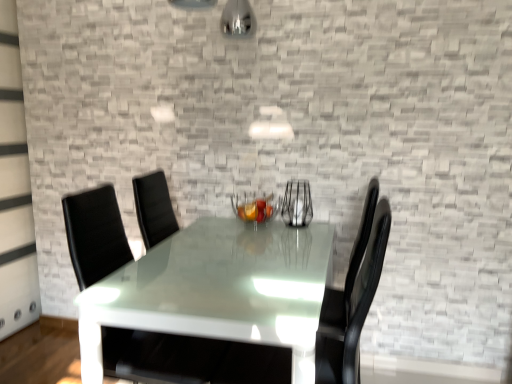
Locate an element on the screen. metallic wire basket at center is located at coordinates (254, 209).

The height and width of the screenshot is (384, 512). What do you see at coordinates (297, 204) in the screenshot? I see `clear glass vase at center` at bounding box center [297, 204].

The image size is (512, 384). What do you see at coordinates (218, 291) in the screenshot?
I see `glossy white table at center` at bounding box center [218, 291].

The height and width of the screenshot is (384, 512). Identify the location of black leather swivel chair at center. (159, 357).

Image resolution: width=512 pixels, height=384 pixels. What are the coordinates of `metallic wire basket at center` in the screenshot? It's located at (254, 209).

Is the position of clear glass vase at center less distant than that of black leather swivel chair at center?

No, it is not.

Between clear glass vase at center and black leather swivel chair at center, which one has larger width?

With larger width is black leather swivel chair at center.

Is clear glass vase at center placed right next to black leather swivel chair at center?

No, clear glass vase at center is not beside black leather swivel chair at center.

Does point (247, 213) lie in front of point (297, 213)?

Yes, it is in front of point (297, 213).

Looking at this image, would you say clear glass vase at center is part of metallic wire basket at center's contents?

Definitely not — clear glass vase at center is not inside metallic wire basket at center.

Is metallic wire basket at center next to clear glass vase at center?

metallic wire basket at center is not next to clear glass vase at center, and they're not touching.

Which of these two, glossy white table at center or metallic wire basket at center, is thinner?

Thinner between the two is metallic wire basket at center.

From a real-world perspective, is glossy white table at center on top of metallic wire basket at center?

Actually, glossy white table at center is physically below metallic wire basket at center in the real world.

What's the angular difference between glossy white table at center and metallic wire basket at center's facing directions?

glossy white table at center and metallic wire basket at center are facing 0.195 degrees away from each other.

In the scene shown: Which of these two, glossy white table at center or black leather swivel chair at center, is wider?

glossy white table at center is wider.

From the picture: From the image's perspective, is glossy white table at center over black leather swivel chair at center?

No, from the image's perspective, glossy white table at center is not above black leather swivel chair at center.

Considering the relative sizes of glossy white table at center and black leather swivel chair at center in the image provided, is glossy white table at center smaller than black leather swivel chair at center?

Actually, glossy white table at center might be larger than black leather swivel chair at center.

Does glossy white table at center turn towards black leather swivel chair at center?

Yes, glossy white table at center faces towards black leather swivel chair at center.

Is clear glass vase at center positioned behind metallic wire basket at center?

Yes, it is behind metallic wire basket at center.

Based on their positions, is clear glass vase at center located to the left or right of metallic wire basket at center?

Based on their positions, clear glass vase at center is located to the right of metallic wire basket at center.

Locate an element on the screen. glass vase above the metallic wire basket at center (from the image's perspective) is located at coordinates (297, 204).

Is clear glass vase at center not near metallic wire basket at center?

They are positioned close to each other.

I want to click on table in front of the clear glass vase at center, so click(218, 291).

Is glossy white table at center positioned behind clear glass vase at center?

No.

Does glossy white table at center turn towards clear glass vase at center?

No, glossy white table at center is not facing towards clear glass vase at center.

Does metallic wire basket at center lie in front of black leather swivel chair at center?

No, metallic wire basket at center is further to the viewer.

Is black leather swivel chair at center at the back of metallic wire basket at center?

No, metallic wire basket at center is not facing away from black leather swivel chair at center.

Is metallic wire basket at center bigger or smaller than black leather swivel chair at center?

metallic wire basket at center is smaller than black leather swivel chair at center.

Is metallic wire basket at center taller or shorter than black leather swivel chair at center?

Clearly, metallic wire basket at center is shorter compared to black leather swivel chair at center.

At what (x,y) coordinates should I click in order to perform the action: click on glass vase located on the right of black leather swivel chair at center. Please return your answer as a coordinate pair (x, y). This screenshot has height=384, width=512. Looking at the image, I should click on (297, 204).

Find the location of `glass vase positioned vertically above the metallic wire basket at center (from a real-world perspective)`. glass vase positioned vertically above the metallic wire basket at center (from a real-world perspective) is located at coordinates (297, 204).

When comparing their distances from clear glass vase at center, does glossy white table at center or metallic wire basket at center seem further?

glossy white table at center.

Which object lies nearer to the anchor point clear glass vase at center, black leather swivel chair at center or glossy white table at center?

The object closer to clear glass vase at center is glossy white table at center.

Based on their spatial positions, is metallic wire basket at center or glossy white table at center further from clear glass vase at center?

glossy white table at center.

Based on their spatial positions, is black leather swivel chair at center or metallic wire basket at center further from clear glass vase at center?

black leather swivel chair at center.

Estimate the real-world distances between objects in this image. Which object is further from glossy white table at center, clear glass vase at center or black leather swivel chair at center?

clear glass vase at center.

Considering their positions, is glossy white table at center positioned closer to clear glass vase at center than black leather swivel chair at center?

glossy white table at center.

Based on their spatial positions, is black leather swivel chair at center or clear glass vase at center further from metallic wire basket at center?

black leather swivel chair at center is positioned further to the anchor metallic wire basket at center.

When comparing their distances from black leather swivel chair at center, does metallic wire basket at center or glossy white table at center seem closer?

Among the two, glossy white table at center is located nearer to black leather swivel chair at center.

The width and height of the screenshot is (512, 384). What are the coordinates of `swivel chair positioned between glossy white table at center and metallic wire basket at center from near to far` in the screenshot? It's located at (159, 357).

This screenshot has height=384, width=512. Identify the location of swivel chair between glossy white table at center and clear glass vase at center in the front-back direction. (159, 357).

You are a GUI agent. You are given a task and a screenshot of the screen. Output one action in this format:
    pyautogui.click(x=<x>, y=<y>)
    Task: Click on the candle holder between glossy white table at center and clear glass vase at center from front to back
    Image resolution: width=512 pixels, height=384 pixels.
    Given the screenshot: What is the action you would take?
    pyautogui.click(x=254, y=209)

Image resolution: width=512 pixels, height=384 pixels. I want to click on candle holder between black leather swivel chair at center and clear glass vase at center in the front-back direction, so click(254, 209).